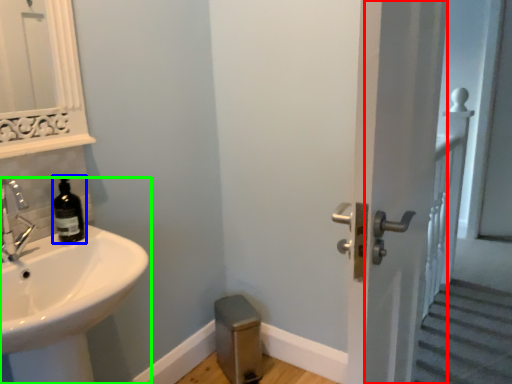
Question: Which object is the closest to the screen door (highlighted by a red box)? Choose among these: bottle (highlighted by a blue box) or sink (highlighted by a green box).

Choices:
 (A) bottle
 (B) sink

Answer: (B)